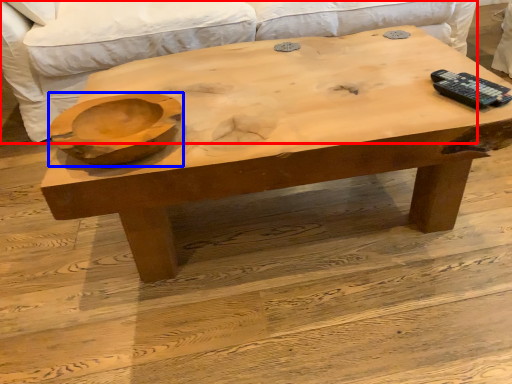
Question: Which object appears farthest to the camera in this image, couch (highlighted by a red box) or bowl (highlighted by a blue box)?

Choices:
 (A) couch
 (B) bowl

Answer: (A)